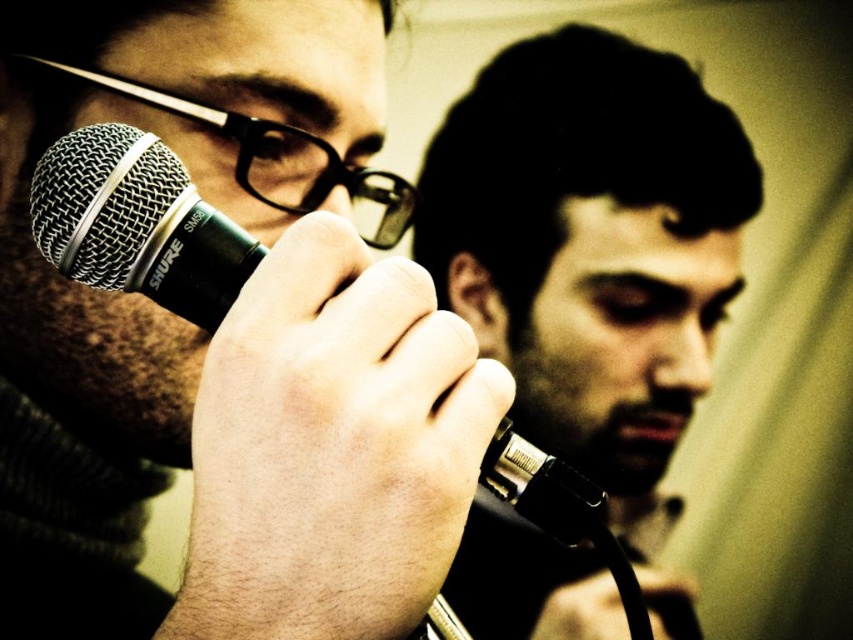
Who is more forward, (573, 600) or (236, 236)?

Point (236, 236)

Is matte black microphone at center positioned before black metallic microphone at center?

No.

Find the location of `matte black microphone at center`. matte black microphone at center is located at coordinates (595, 257).

Can you confirm if matte black microphone at center is positioned to the left of black plastic glasses at upper left?

Incorrect, matte black microphone at center is not on the left side of black plastic glasses at upper left.

Between matte black microphone at center and black plastic glasses at upper left, which one has more height?

matte black microphone at center is taller.

Image resolution: width=853 pixels, height=640 pixels. Identify the location of matte black microphone at center. (595, 257).

At what (x,y) coordinates should I click in order to perform the action: click on matte black microphone at center. Please return your answer as a coordinate pair (x, y). Image resolution: width=853 pixels, height=640 pixels. Looking at the image, I should click on (595, 257).

Between black metallic microphone at center and black plastic glasses at upper left, which one has more height?

black metallic microphone at center is taller.

This screenshot has height=640, width=853. What do you see at coordinates (137, 224) in the screenshot? I see `black metallic microphone at center` at bounding box center [137, 224].

At what (x,y) coordinates should I click in order to perform the action: click on black metallic microphone at center. Please return your answer as a coordinate pair (x, y). Looking at the image, I should click on (137, 224).